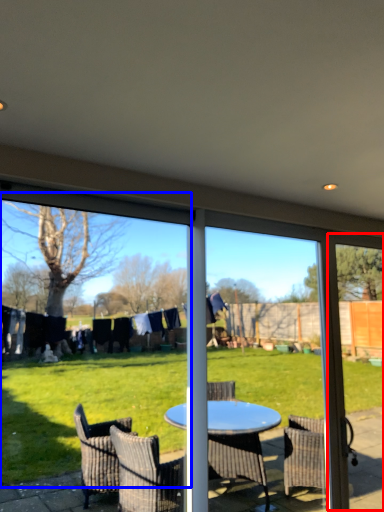
Question: Which object appears closest to the camera in this image, screen door (highlighted by a red box) or window screen (highlighted by a blue box)?

Choices:
 (A) screen door
 (B) window screen

Answer: (B)